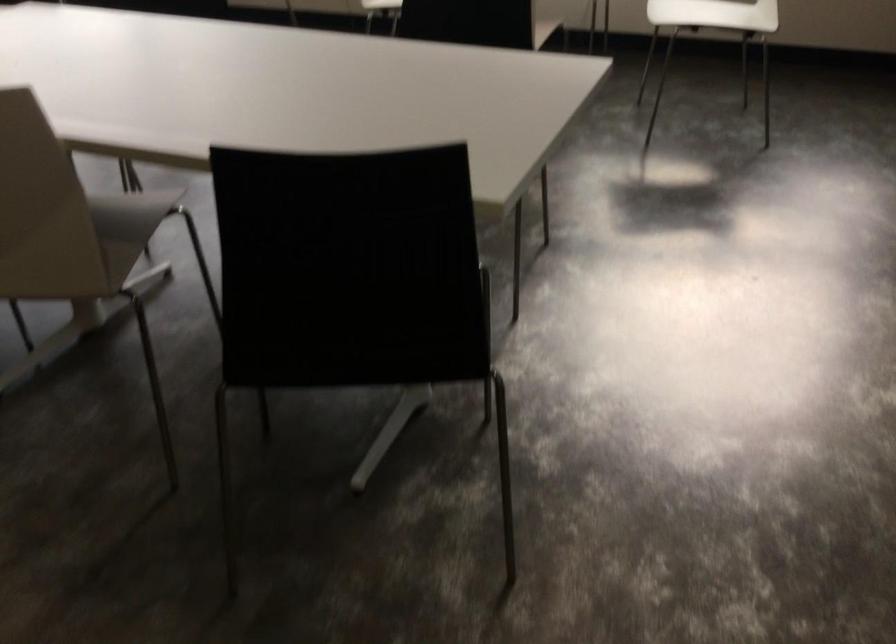
This screenshot has width=896, height=644. What do you see at coordinates (714, 14) in the screenshot?
I see `a light-colored chair sitting surface` at bounding box center [714, 14].